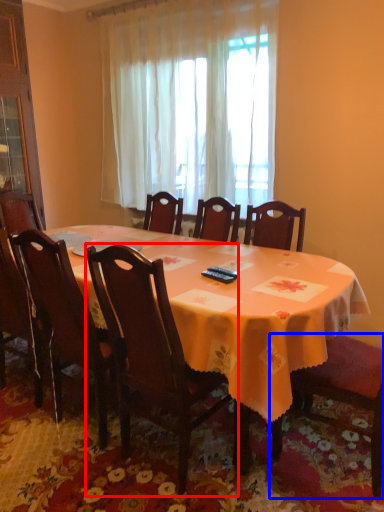
Question: Which object is further to the camera taking this photo, chair (highlighted by a red box) or chair (highlighted by a blue box)?

Choices:
 (A) chair
 (B) chair

Answer: (B)